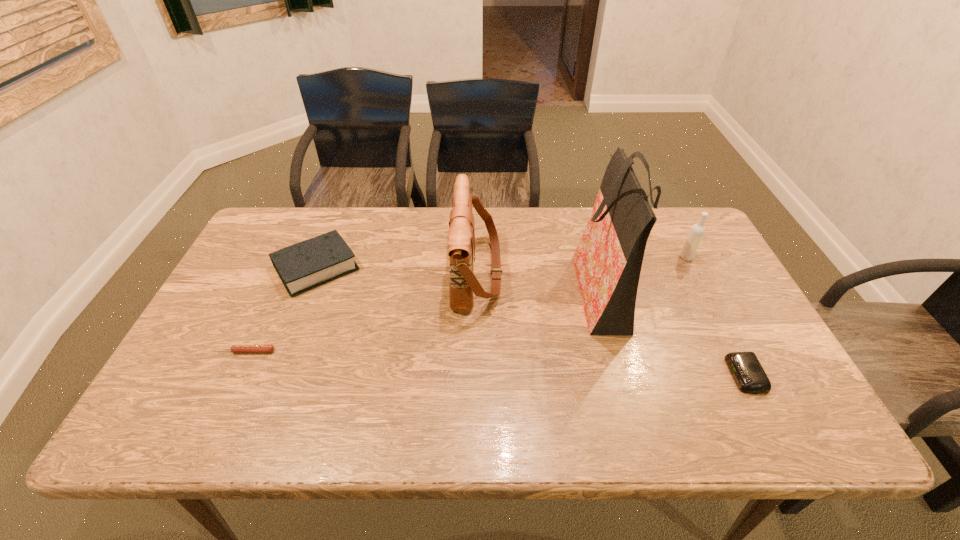
At what (x,y) coordinates should I click in order to perform the action: click on shopping bag that is at the far edge. Please return your answer as a coordinate pair (x, y). The image size is (960, 540). Looking at the image, I should click on coord(608,260).

This screenshot has width=960, height=540. I want to click on shoulder bag situated at the far edge, so click(x=461, y=237).

I want to click on vodka present at the far edge, so click(697, 231).

Locate an element on the screen. This screenshot has width=960, height=540. Bible that is at the far edge is located at coordinates (310, 263).

I want to click on Bible at the left edge, so click(310, 263).

Find the location of a particular element. This screenshot has width=960, height=540. sausage located in the left edge section of the desktop is located at coordinates (234, 348).

Where is `vodka positioned at the right edge`? This screenshot has height=540, width=960. vodka positioned at the right edge is located at coordinates (697, 231).

Find the location of a particular element. The height and width of the screenshot is (540, 960). alarm clock positioned at the right edge is located at coordinates (750, 377).

At what (x,y) coordinates should I click in order to perform the action: click on object at the far left corner. Please return your answer as a coordinate pair (x, y). The height and width of the screenshot is (540, 960). Looking at the image, I should click on (310, 263).

At what (x,y) coordinates should I click in order to perform the action: click on object present at the far right corner. Please return your answer as a coordinate pair (x, y). Looking at the image, I should click on (697, 231).